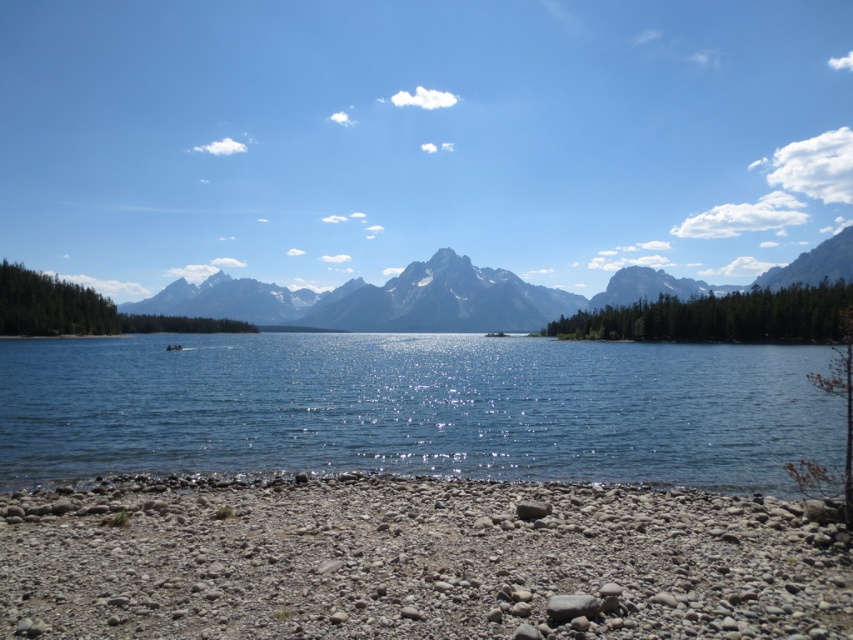
Between white snow-covered mountain at center and white plastic boat at center, which one appears on the left side from the viewer's perspective?

white plastic boat at center

Does white snow-covered mountain at center come behind white plastic boat at center?

Yes, white snow-covered mountain at center is behind white plastic boat at center.

The width and height of the screenshot is (853, 640). Identify the location of white snow-covered mountain at center. (445, 300).

The height and width of the screenshot is (640, 853). I want to click on white snow-covered mountain at center, so click(445, 300).

The width and height of the screenshot is (853, 640). Describe the element at coordinates (412, 561) in the screenshot. I see `gray gravel at lower center` at that location.

Between point (843, 604) and point (39, 410), which one is positioned in front?

Positioned in front is point (843, 604).

Who is more forward, [102,573] or [357,417]?

Point [102,573] is more forward.

Find the location of `gray gravel at lower center`. gray gravel at lower center is located at coordinates (412, 561).

Does gray gravel at lower center have a greater height compared to white snow-covered mountain at center?

Incorrect, gray gravel at lower center's height is not larger of white snow-covered mountain at center's.

Identify the location of gray gravel at lower center. This screenshot has width=853, height=640. (412, 561).

I want to click on gray gravel at lower center, so click(x=412, y=561).